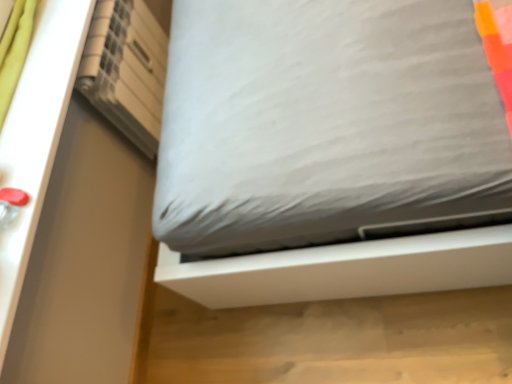
Question: Can you confirm if white matte shelf at upper left is taller than white fabric bed at center?

Choices:
 (A) yes
 (B) no

Answer: (A)

Question: From a real-world perspective, is white matte shelf at upper left on white fabric bed at center?

Choices:
 (A) no
 (B) yes

Answer: (B)

Question: Does white matte shelf at upper left have a larger size compared to white fabric bed at center?

Choices:
 (A) yes
 (B) no

Answer: (A)

Question: From the image's perspective, is white matte shelf at upper left on top of white fabric bed at center?

Choices:
 (A) no
 (B) yes

Answer: (B)

Question: Does white matte shelf at upper left have a greater width compared to white fabric bed at center?

Choices:
 (A) yes
 (B) no

Answer: (B)

Question: Does white matte shelf at upper left have a lesser height compared to white fabric bed at center?

Choices:
 (A) yes
 (B) no

Answer: (B)

Question: Does white fabric bed at center lie in front of white matte shelf at upper left?

Choices:
 (A) yes
 (B) no

Answer: (A)

Question: Is white fabric bed at center smaller than white matte shelf at upper left?

Choices:
 (A) yes
 (B) no

Answer: (A)

Question: Can you confirm if white fabric bed at center is taller than white matte shelf at upper left?

Choices:
 (A) no
 (B) yes

Answer: (A)

Question: From a real-world perspective, does white fabric bed at center sit lower than white matte shelf at upper left?

Choices:
 (A) no
 (B) yes

Answer: (B)

Question: Is white fabric bed at center at the left side of white matte shelf at upper left?

Choices:
 (A) yes
 (B) no

Answer: (B)

Question: Is white fabric bed at center placed right next to white matte shelf at upper left?

Choices:
 (A) yes
 (B) no

Answer: (B)

Question: From the image's perspective, relative to white fabric bed at center, is white matte shelf at upper left above or below?

Choices:
 (A) above
 (B) below

Answer: (A)